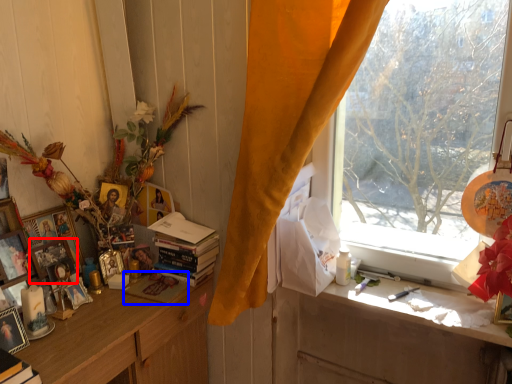
Question: Among these objects, which one is nearest to the camera, picture frame (highlighted by a red box) or magazine (highlighted by a blue box)?

Choices:
 (A) picture frame
 (B) magazine

Answer: (A)